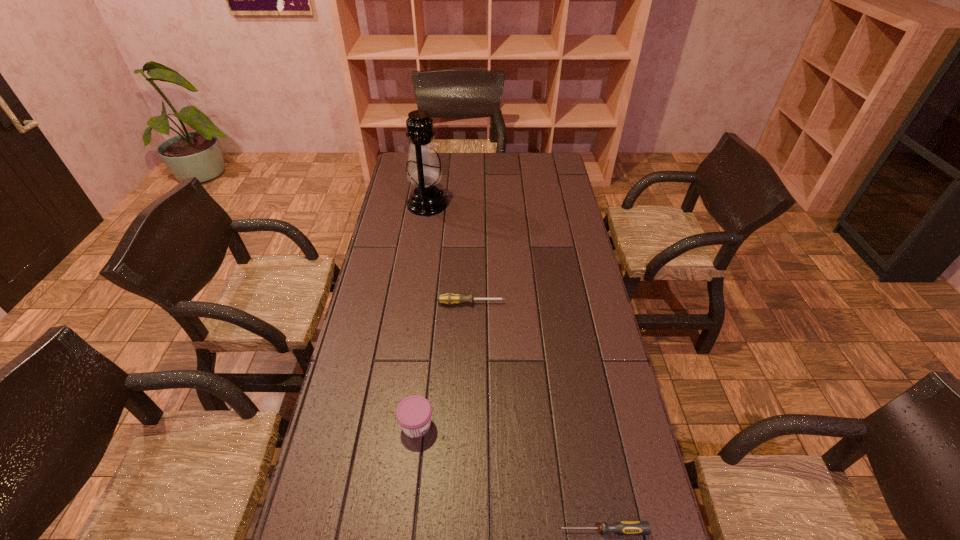
Locate an element on the screen. The height and width of the screenshot is (540, 960). object that is the closest one to the third farthest object is located at coordinates (624, 527).